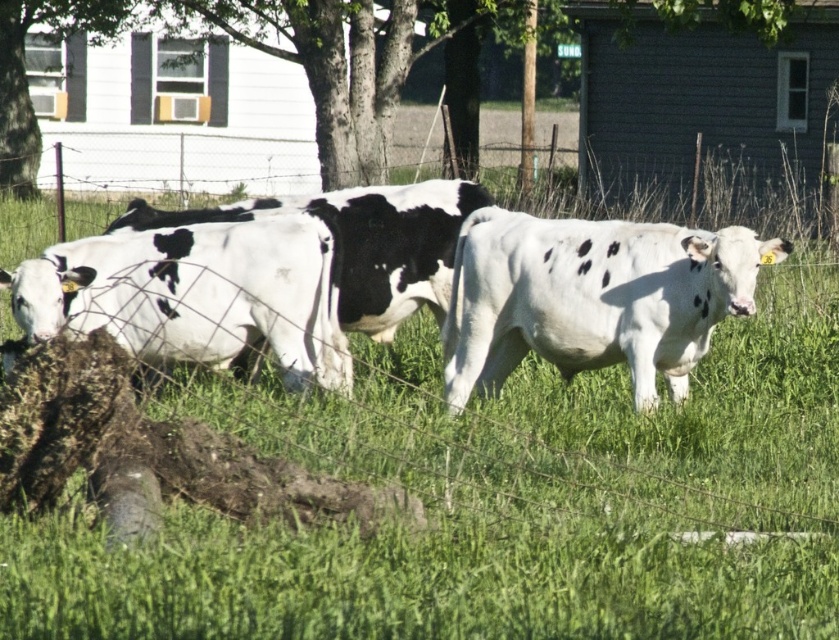
Question: Is white speckled cow at left behind black and white spotted cow at center?

Choices:
 (A) no
 (B) yes

Answer: (A)

Question: Which object is closer to the camera taking this photo?

Choices:
 (A) green leafy tree at upper center
 (B) white spotted cow at center
 (C) white smooth cow at center
 (D) black and white spotted cow at center

Answer: (B)

Question: Which point appears farthest from the camera in this image?

Choices:
 (A) (353, 150)
 (B) (425, 300)
 (C) (514, 310)
 (D) (100, 324)

Answer: (A)

Question: Which of these objects is positioned farthest from the white smooth cow at center?

Choices:
 (A) green leafy tree at upper center
 (B) white spotted cow at center
 (C) black and white spotted cow at center
 (D) white speckled cow at left

Answer: (A)

Question: Does white spotted cow at center appear on the left side of black and white spotted cow at center?

Choices:
 (A) no
 (B) yes

Answer: (A)

Question: Where is green leafy tree at upper center located in relation to white speckled cow at left in the image?

Choices:
 (A) above
 (B) below

Answer: (A)